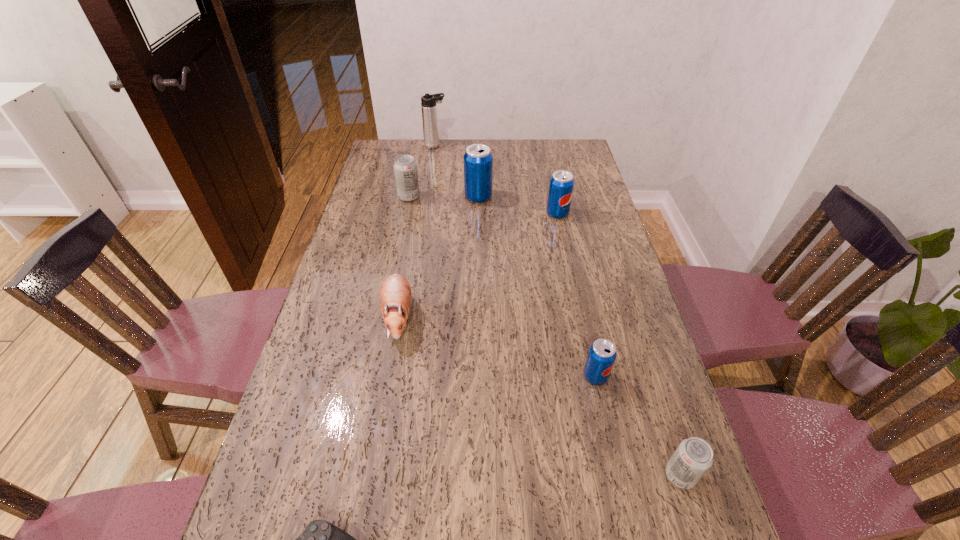
Locate an element on the screen. This screenshot has width=960, height=540. free area in between the seventh shortest object and the nearest blue pop soda is located at coordinates coord(537,287).

Locate an element on the screen. This screenshot has width=960, height=540. blank region between the rightmost soda can and the farther gray soda can is located at coordinates (544, 336).

Find the location of a particular element. empty space that is in between the left gray soda can and the farthest object is located at coordinates (422, 171).

In order to click on empty space between the fifth farthest object and the thermos bottle in this screenshot , I will do `click(417, 231)`.

Find the location of a particular element. This screenshot has width=960, height=540. free area in between the farthest object and the rightmost object is located at coordinates (558, 310).

The image size is (960, 540). Identify the location of object that is the fifth closest to the nearest soda can. (478, 160).

Where is `the closest object to the thermos bottle`? The width and height of the screenshot is (960, 540). the closest object to the thermos bottle is located at coordinates (405, 167).

The width and height of the screenshot is (960, 540). I want to click on soda can that is the fourth nearest to the control, so (x=478, y=160).

Point out which soda can is positioned as the nearest to the second nearest blue pop soda. Please provide its 2D coordinates. Your answer should be formatted as a tuple, i.e. [(x, y)], where the tuple contains the x and y coordinates of a point satisfying the conditions above.

[(478, 160)]

This screenshot has width=960, height=540. Identify the location of the third closest blue pop soda to the fifth farthest object. (561, 185).